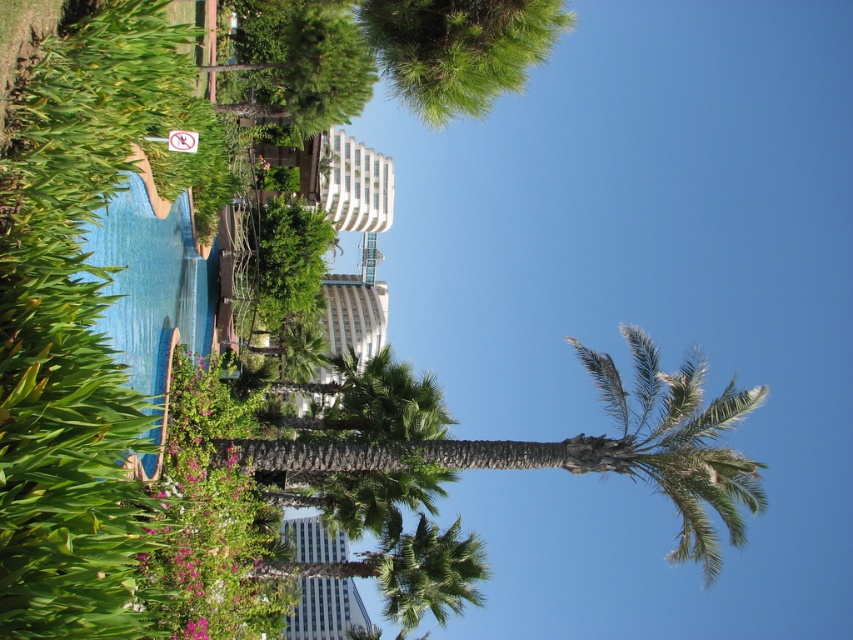
Is green leafy palm tree at center to the right of white plastic sign at upper center from the viewer's perspective?

Yes, green leafy palm tree at center is to the right of white plastic sign at upper center.

Which is more to the right, green leafy palm tree at center or white plastic sign at upper center?

Positioned to the right is green leafy palm tree at center.

Locate an element on the screen. green leafy palm tree at center is located at coordinates (427, 572).

Where is `green leafy palm tree at center`? green leafy palm tree at center is located at coordinates (427, 572).

Is green textured palm tree at center further to the viewer compared to white plastic sign at upper center?

Yes.

Does green textured palm tree at center have a larger size compared to white plastic sign at upper center?

Correct, green textured palm tree at center is larger in size than white plastic sign at upper center.

Does point (693, 480) lie in front of point (183, 148)?

No.

You are a GUI agent. You are given a task and a screenshot of the screen. Output one action in this format:
    pyautogui.click(x=<x>, y=<y>)
    Task: Click on the green textured palm tree at center
    Image resolution: width=853 pixels, height=640 pixels.
    Given the screenshot: What is the action you would take?
    pyautogui.click(x=589, y=448)

Can you confirm if green textured palm tree at center is positioned below green leafy palm tree at center?

No.

Is point (349, 448) positioned after point (448, 556)?

No, (349, 448) is in front of (448, 556).

Between point (639, 440) and point (390, 605), which one is positioned in front?

Point (639, 440)

What are the coordinates of `green textured palm tree at center` in the screenshot? It's located at 589,448.